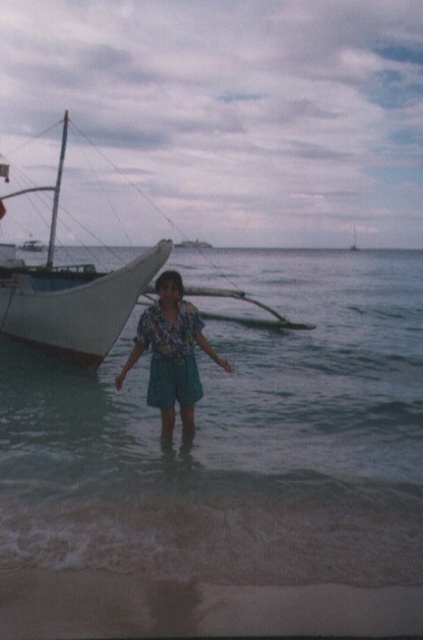
Question: Is white matte boat at left closer to camera compared to floral fabric shirt at center?

Choices:
 (A) yes
 (B) no

Answer: (B)

Question: Which point appears farthest from the camera in this image?

Choices:
 (A) (159, 348)
 (B) (121, 307)
 (C) (375, 577)

Answer: (B)

Question: Does clear water at center appear on the left side of floral fabric shirt at center?

Choices:
 (A) no
 (B) yes

Answer: (A)

Question: Which point is farther to the camera?

Choices:
 (A) white matte boat at left
 (B) floral fabric shirt at center
 (C) clear water at center

Answer: (A)

Question: Is clear water at center positioned at the back of floral fabric shirt at center?

Choices:
 (A) yes
 (B) no

Answer: (B)

Question: Which of the following is the closest to the observer?

Choices:
 (A) [98, 502]
 (B) [21, 285]
 (C) [173, 358]

Answer: (A)